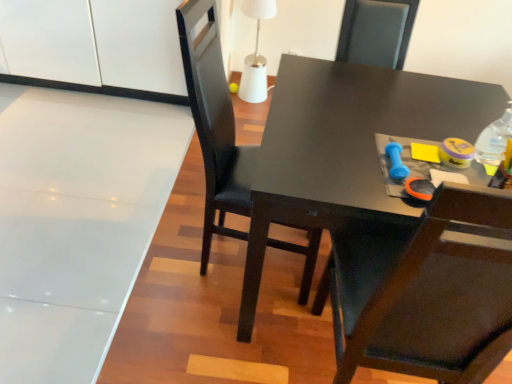
Question: Should I look upward or downward to see blue rubber dumbbell at upper right?

Choices:
 (A) up
 (B) down

Answer: (A)

Question: Is matte black table at center surrounded by matte black chair at center?

Choices:
 (A) no
 (B) yes

Answer: (A)

Question: Considering the relative sizes of matte black chair at center and matte black table at center in the image provided, is matte black chair at center thinner than matte black table at center?

Choices:
 (A) no
 (B) yes

Answer: (B)

Question: Does matte black chair at center come behind matte black table at center?

Choices:
 (A) yes
 (B) no

Answer: (B)

Question: From a real-world perspective, is matte black chair at center on top of matte black table at center?

Choices:
 (A) yes
 (B) no

Answer: (A)

Question: Does matte black chair at center have a lesser height compared to matte black table at center?

Choices:
 (A) no
 (B) yes

Answer: (A)

Question: From the image's perspective, would you say matte black chair at center is positioned over matte black table at center?

Choices:
 (A) no
 (B) yes

Answer: (B)

Question: From a real-world perspective, is matte black table at center positioned over white glossy cabinet at upper left based on gravity?

Choices:
 (A) yes
 (B) no

Answer: (A)

Question: Does matte black table at center appear on the left side of white glossy cabinet at upper left?

Choices:
 (A) no
 (B) yes

Answer: (A)

Question: From a real-world perspective, does matte black table at center sit lower than white glossy cabinet at upper left?

Choices:
 (A) yes
 (B) no

Answer: (B)

Question: Is matte black table at center looking in the opposite direction of white glossy cabinet at upper left?

Choices:
 (A) no
 (B) yes

Answer: (A)

Question: Is white glossy cabinet at upper left completely or partially inside matte black table at center?

Choices:
 (A) no
 (B) yes

Answer: (A)

Question: Is matte black table at center beside white glossy cabinet at upper left?

Choices:
 (A) yes
 (B) no

Answer: (B)

Question: Considering the relative sizes of blue rubber dumbbell at upper right and matte black table at center in the image provided, is blue rubber dumbbell at upper right bigger than matte black table at center?

Choices:
 (A) yes
 (B) no

Answer: (B)